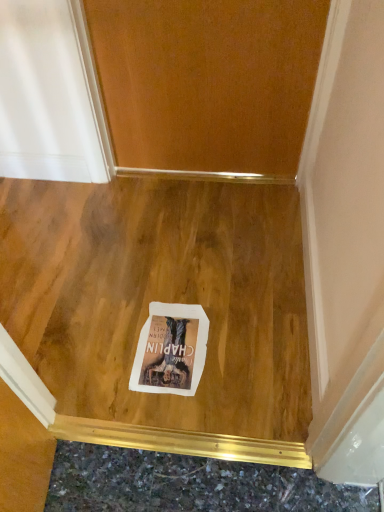
Find the location of `wooden floor at center`. wooden floor at center is located at coordinates (148, 312).

Identify the location of white paper postcard at center. (171, 350).

From a real-world perspective, is wooden door at center below white paper postcard at center?

Actually, wooden door at center is physically above white paper postcard at center in the real world.

Is wooden door at center far away from white paper postcard at center?

That's not correct — wooden door at center is a little close to white paper postcard at center.

Between wooden door at center and white paper postcard at center, which one has more height?

wooden door at center.

Which of these two, wooden door at center or white paper postcard at center, is wider?

With larger width is white paper postcard at center.

From a real-world perspective, who is located higher, white paper postcard at center or wooden floor at center?

From a 3D spatial view, wooden floor at center is above.

Find the location of a particular element. The height and width of the screenshot is (512, 384). plywood above the white paper postcard at center (from the image's perspective) is located at coordinates (148, 312).

Is white paper postcard at center far away from wooden floor at center?

No, white paper postcard at center is in close proximity to wooden floor at center.

Which object is wider, wooden floor at center or white paper postcard at center?

With larger width is wooden floor at center.

Is wooden floor at center in front of or behind white paper postcard at center in the image?

Clearly, wooden floor at center is in front of white paper postcard at center.

Is wooden floor at center not close to white paper postcard at center?

No, wooden floor at center is not far away from white paper postcard at center.

Can you confirm if wooden floor at center is shorter than white paper postcard at center?

No.

Which is in front, point (202, 383) or point (214, 170)?

The point (202, 383) is in front.

From the image's perspective, which is below, wooden floor at center or wooden door at center?

From the image's view, wooden floor at center is below.

Which is more to the right, wooden floor at center or wooden door at center?

wooden door at center.

Between wooden floor at center and wooden door at center, which one is positioned behind?

wooden door at center is more distant.

Between wooden door at center and wooden floor at center, which one appears on the right side from the viewer's perspective?

wooden door at center is more to the right.

Based on their sizes in the image, would you say wooden door at center is bigger or smaller than wooden floor at center?

Considering their sizes, wooden door at center takes up more space than wooden floor at center.

Is wooden door at center facing away from wooden floor at center?

No, wooden door at center is not facing the opposite direction of wooden floor at center.

Can we say wooden door at center lies outside wooden floor at center?

Indeed, wooden door at center is completely outside wooden floor at center.

Does white paper postcard at center have a lesser height compared to wooden door at center?

Indeed, white paper postcard at center has a lesser height compared to wooden door at center.

Does point (175, 392) come closer to viewer compared to point (220, 163)?

Yes, point (175, 392) is closer to viewer.

Relative to wooden door at center, is white paper postcard at center in front or behind?

Visually, white paper postcard at center is located in front of wooden door at center.

In the scene shown: From the image's perspective, does white paper postcard at center appear higher than wooden door at center?

No, from the image's perspective, white paper postcard at center is not on top of wooden door at center.

In order to click on door on the right of the white paper postcard at center in this screenshot , I will do `click(207, 81)`.

Find the location of a particular element. This screenshot has width=384, height=512. postcard that is behind the wooden floor at center is located at coordinates [171, 350].

Which object lies further to the anchor point wooden door at center, wooden floor at center or white paper postcard at center?

The object further to wooden door at center is white paper postcard at center.

Considering their positions, is wooden floor at center positioned further to white paper postcard at center than wooden door at center?

wooden door at center is further to white paper postcard at center.

In the scene shown: Based on their spatial positions, is wooden door at center or white paper postcard at center closer to wooden floor at center?

white paper postcard at center is closer to wooden floor at center.

From the image, which object appears to be farther from white paper postcard at center, wooden door at center or wooden floor at center?

wooden door at center.

When comparing their distances from wooden door at center, does white paper postcard at center or wooden floor at center seem closer?

The object closer to wooden door at center is wooden floor at center.

Which object lies further to the anchor point wooden floor at center, white paper postcard at center or wooden door at center?

wooden door at center.

This screenshot has height=512, width=384. Find the location of `plywood between wooden door at center and white paper postcard at center in the vertical direction`. plywood between wooden door at center and white paper postcard at center in the vertical direction is located at coordinates (148, 312).